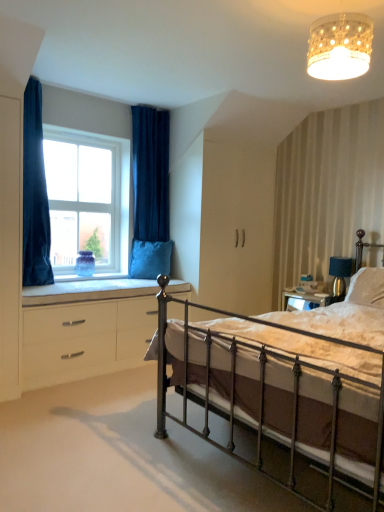
What do you see at coordinates (150, 173) in the screenshot? I see `velvet blue curtain at upper left, placed as the 2th curtain when sorted from front to back` at bounding box center [150, 173].

Image resolution: width=384 pixels, height=512 pixels. What are the coordinates of `velvet blue pillow at window, the first pillow in the left-to-right sequence` in the screenshot? It's located at (150, 259).

Image resolution: width=384 pixels, height=512 pixels. Describe the element at coordinates (150, 259) in the screenshot. I see `velvet blue pillow at window, which is counted as the 2th pillow, starting from the right` at that location.

Locate an element on the screen. The width and height of the screenshot is (384, 512). white glass window at upper left is located at coordinates (87, 199).

Measure the distance between point [68,224] and camera.

Point [68,224] is 3.99 meters away from camera.

What is the approximate height of blue fabric table lamp at right?

The height of blue fabric table lamp at right is 13.16 inches.

At what (x,y) coordinates should I click in order to perform the action: click on white textured lampshade at upper center. Please return your answer as a coordinate pair (x, y). Looking at the image, I should click on (340, 46).

What do you see at coordinates (284, 381) in the screenshot? The image size is (384, 512). I see `polished metal bed at center` at bounding box center [284, 381].

This screenshot has width=384, height=512. What do you see at coordinates (87, 332) in the screenshot?
I see `white glossy chest of drawers at lower left` at bounding box center [87, 332].

Identify the location of velvet blue curtain at upper left, the first curtain when ordered from right to left. (150, 173).

Is white glossy chest of drawers at lower left inside the boundaries of velvet blue pillow at window, the 2th pillow when ordered from front to back, or outside?

white glossy chest of drawers at lower left lies outside velvet blue pillow at window, the 2th pillow when ordered from front to back.

Which is more distant, (30, 313) or (154, 277)?

Positioned behind is point (154, 277).

Is the depth of white glossy chest of drawers at lower left greater than that of velvet blue pillow at window, placed as the first pillow when sorted from back to front?

No, white glossy chest of drawers at lower left is in front of velvet blue pillow at window, placed as the first pillow when sorted from back to front.

Does white glossy chest of drawers at lower left appear on the right side of velvet blue pillow at window, which is counted as the 2th pillow, starting from the right?

In fact, white glossy chest of drawers at lower left is to the left of velvet blue pillow at window, which is counted as the 2th pillow, starting from the right.

Which is behind, point (189, 286) or point (368, 301)?

The point (189, 286) is behind.

From the picture: Looking at the image, does blue velvet cushion at lower left seem bigger or smaller compared to white textured pillow at right, the second pillow when ordered from left to right?

Clearly, blue velvet cushion at lower left is larger in size than white textured pillow at right, the second pillow when ordered from left to right.

From the image's perspective, starting from the blue velvet cushion at lower left, which pillow is the 1st one above? Please provide its 2D coordinates.

[(367, 287)]

Could white textured pillow at right, acting as the first pillow starting from the front, be considered to be inside blue velvet cushion at lower left?

No, blue velvet cushion at lower left does not contain white textured pillow at right, acting as the first pillow starting from the front.

Is blue velvet cushion at lower left positioned with its back to velvet blue curtain at left, marked as the 2th curtain in a back-to-front arrangement?

That's not correct — blue velvet cushion at lower left is not looking away from velvet blue curtain at left, marked as the 2th curtain in a back-to-front arrangement.

Locate an element on the screen. Image resolution: width=384 pixels, height=512 pixels. window sill in front of the velvet blue curtain at left, marked as the 2th curtain in a back-to-front arrangement is located at coordinates (88, 290).

Which object is positioned more to the right, blue velvet cushion at lower left or velvet blue curtain at left, marked as the second curtain in a right-to-left arrangement?

From the viewer's perspective, blue velvet cushion at lower left appears more on the right side.

In the image, is blue velvet cushion at lower left positioned in front of or behind velvet blue curtain at left, the 1th curtain from the front?

Clearly, blue velvet cushion at lower left is in front of velvet blue curtain at left, the 1th curtain from the front.

Does velvet blue curtain at left, the 1th curtain from the front, turn towards velvet blue pillow at window, placed as the first pillow when sorted from back to front?

No, velvet blue curtain at left, the 1th curtain from the front, is not aimed at velvet blue pillow at window, placed as the first pillow when sorted from back to front.

Is there a large distance between velvet blue curtain at left, which is counted as the 1th curtain, starting from the left, and velvet blue pillow at window, which is counted as the 2th pillow, starting from the right?

velvet blue curtain at left, which is counted as the 1th curtain, starting from the left, is positioned a significant distance from velvet blue pillow at window, which is counted as the 2th pillow, starting from the right.

Considering the relative sizes of velvet blue curtain at left, the 1th curtain from the front, and velvet blue pillow at window, the first pillow in the left-to-right sequence, in the image provided, is velvet blue curtain at left, the 1th curtain from the front, smaller than velvet blue pillow at window, the first pillow in the left-to-right sequence,?

Actually, velvet blue curtain at left, the 1th curtain from the front, might be larger than velvet blue pillow at window, the first pillow in the left-to-right sequence.

Which is nearer, (32, 109) or (166, 248)?

The point (32, 109) is closer to the camera.

Can you confirm if velvet blue curtain at left, the 1th curtain from the front, is shorter than polished metal bed at center?

In fact, velvet blue curtain at left, the 1th curtain from the front, may be taller than polished metal bed at center.

In terms of size, does velvet blue curtain at left, which is counted as the 1th curtain, starting from the left, appear bigger or smaller than polished metal bed at center?

Considering their sizes, velvet blue curtain at left, which is counted as the 1th curtain, starting from the left, takes up less space than polished metal bed at center.

At what (x,y) coordinates should I click in order to perform the action: click on bed located underneath the velvet blue curtain at left, the 1th curtain from the front (from a real-world perspective). Please return your answer as a coordinate pair (x, y). The width and height of the screenshot is (384, 512). Looking at the image, I should click on (284, 381).

Which object is thinner, velvet blue curtain at left, which is counted as the 1th curtain, starting from the left, or polished metal bed at center?

velvet blue curtain at left, which is counted as the 1th curtain, starting from the left, is thinner.

In terms of width, does white textured lampshade at upper center look wider or thinner when compared to white glass window at upper left?

Clearly, white textured lampshade at upper center has more width compared to white glass window at upper left.

From the picture: From the image's perspective, which is below, white textured lampshade at upper center or white glass window at upper left?

white glass window at upper left, from the image's perspective.

Could you tell me if white textured lampshade at upper center is turned towards white glass window at upper left?

No, white textured lampshade at upper center is not facing towards white glass window at upper left.

The height and width of the screenshot is (512, 384). I want to click on curtain in front of the blue fabric table lamp at right, so click(35, 193).

Is velvet blue curtain at left, which is counted as the 1th curtain, starting from the left, aimed at blue fabric table lamp at right?

No, velvet blue curtain at left, which is counted as the 1th curtain, starting from the left, is not aimed at blue fabric table lamp at right.

Considering the points (29, 119) and (335, 277), which point is in front, point (29, 119) or point (335, 277)?

Point (29, 119)

This screenshot has height=512, width=384. I want to click on the chest of drawers that is in front of the velvet blue pillow at window, the first pillow in the left-to-right sequence, so click(87, 332).

The height and width of the screenshot is (512, 384). What are the coordinates of `window sill below the white textured pillow at right, the second pillow in the back-to-front sequence (from the image's perspective)` in the screenshot? It's located at (88, 290).

From the image, which object appears to be farther from white glass window at upper left, white glossy chest of drawers at lower left or velvet blue curtain at upper left, which is the 2th curtain from left to right?

The object further to white glass window at upper left is white glossy chest of drawers at lower left.

Looking at the image, which one is located further to white textured lampshade at upper center, white glass window at upper left or white textured pillow at right, acting as the first pillow starting from the front?

white glass window at upper left.

Which object lies nearer to the anchor point white glossy chest of drawers at lower left, polished metal bed at center or white glass window at upper left?

white glass window at upper left.

From the image, which object appears to be nearer to white glossy chest of drawers at lower left, velvet blue curtain at upper left, which is the 2th curtain from left to right, or white textured pillow at right, acting as the first pillow starting from the front?

velvet blue curtain at upper left, which is the 2th curtain from left to right.

Considering their positions, is white textured pillow at right, the second pillow when ordered from left to right, positioned further to blue fabric table lamp at right than blue velvet cushion at lower left?

blue velvet cushion at lower left lies further to blue fabric table lamp at right than the other object.

Which object lies further to the anchor point white glossy chest of drawers at lower left, white glass window at upper left or velvet blue pillow at window, placed as the first pillow when sorted from back to front?

white glass window at upper left is further to white glossy chest of drawers at lower left.

When comparing their distances from white textured pillow at right, which appears as the first pillow when viewed from the right, does white glossy chest of drawers at lower left or blue velvet cushion at lower left seem further?

Based on the image, white glossy chest of drawers at lower left appears to be further to white textured pillow at right, which appears as the first pillow when viewed from the right.

Based on their spatial positions, is velvet blue pillow at window, which is counted as the 2th pillow, starting from the right, or white textured lampshade at upper center further from blue fabric table lamp at right?

The object further to blue fabric table lamp at right is white textured lampshade at upper center.

Find the location of a particular element. window between blue velvet cushion at lower left and velvet blue pillow at window, the 2th pillow when ordered from front to back, from front to back is located at coordinates (87, 199).

The height and width of the screenshot is (512, 384). Find the location of `window located between polished metal bed at center and velvet blue curtain at upper left, the first curtain when ordered from right to left, in the depth direction`. window located between polished metal bed at center and velvet blue curtain at upper left, the first curtain when ordered from right to left, in the depth direction is located at coordinates (87, 199).

Locate an element on the screen. Image resolution: width=384 pixels, height=512 pixels. window between velvet blue curtain at left, marked as the 2th curtain in a back-to-front arrangement, and white glossy chest of drawers at lower left from top to bottom is located at coordinates (87, 199).

Find the location of `window between velvet blue curtain at left, marked as the second curtain in a right-to-left arrangement, and velvet blue pillow at window, which is counted as the 2th pillow, starting from the right, from front to back`. window between velvet blue curtain at left, marked as the second curtain in a right-to-left arrangement, and velvet blue pillow at window, which is counted as the 2th pillow, starting from the right, from front to back is located at coordinates (87, 199).